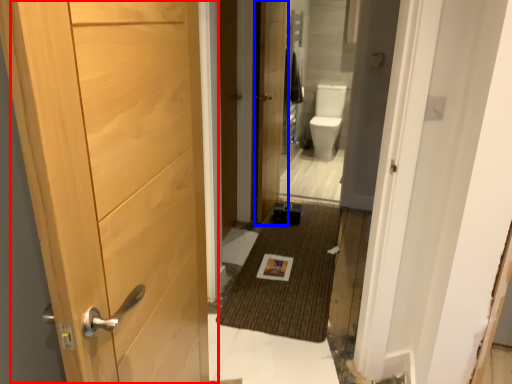
Question: Among these objects, which one is nearest to the camera, door (highlighted by a red box) or door (highlighted by a blue box)?

Choices:
 (A) door
 (B) door

Answer: (A)